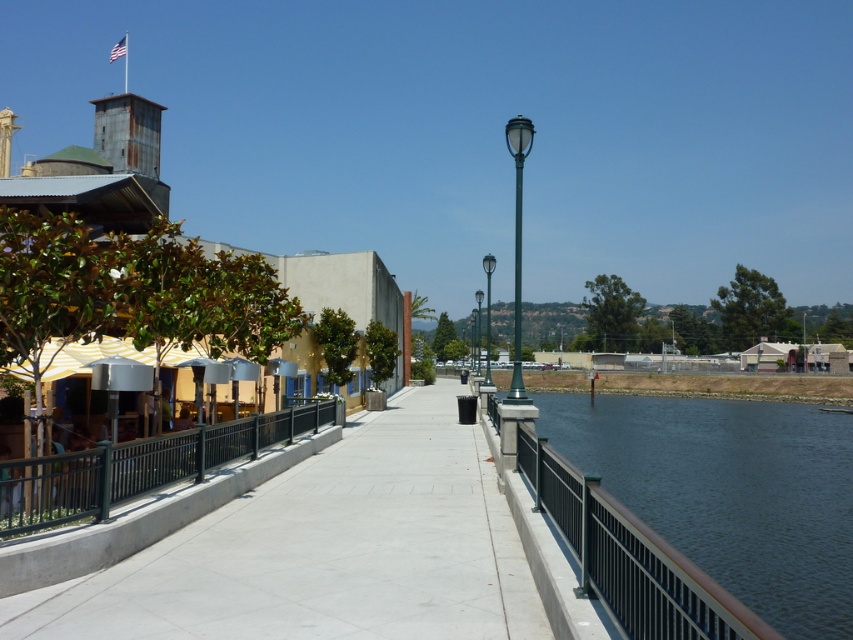
Looking at this image, you are standing on the walkway and want to take a photo of the dark blue water at center and the green metallic pole at center. Which object should you position to your left side in the frame to capture both in the shot?

To capture both the dark blue water at center and the green metallic pole at center in the shot, you should position the green metallic pole at center to your left side in the frame since the dark blue water at center is located to the right of it.